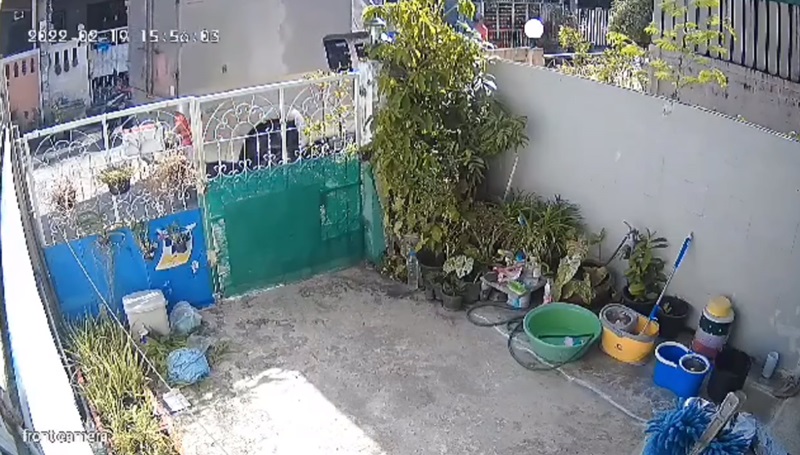
At what (x,y) coordinates should I click in order to perform the action: click on plant. Please return your answer as a coordinate pair (x, y). Image resolution: width=800 pixels, height=455 pixels. Looking at the image, I should click on (118, 363).